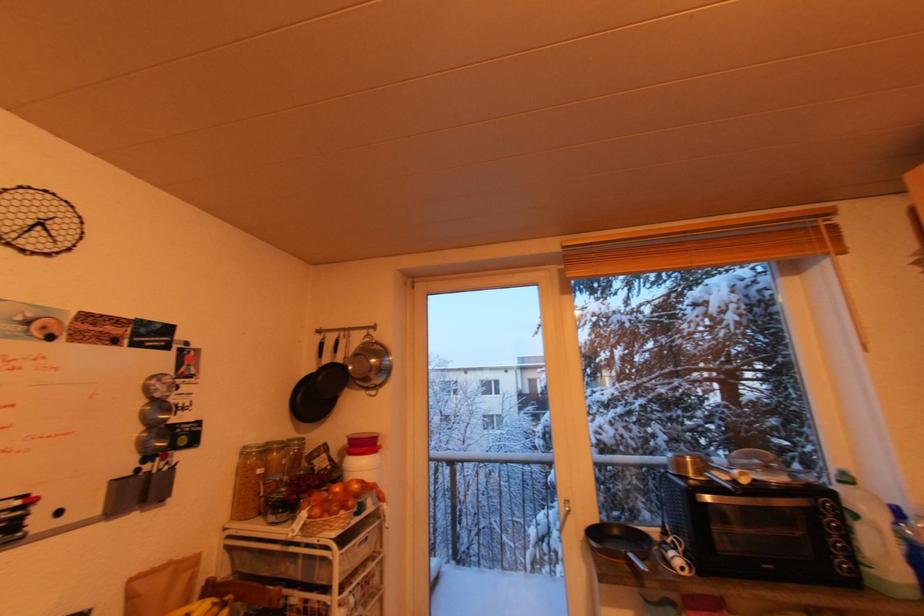
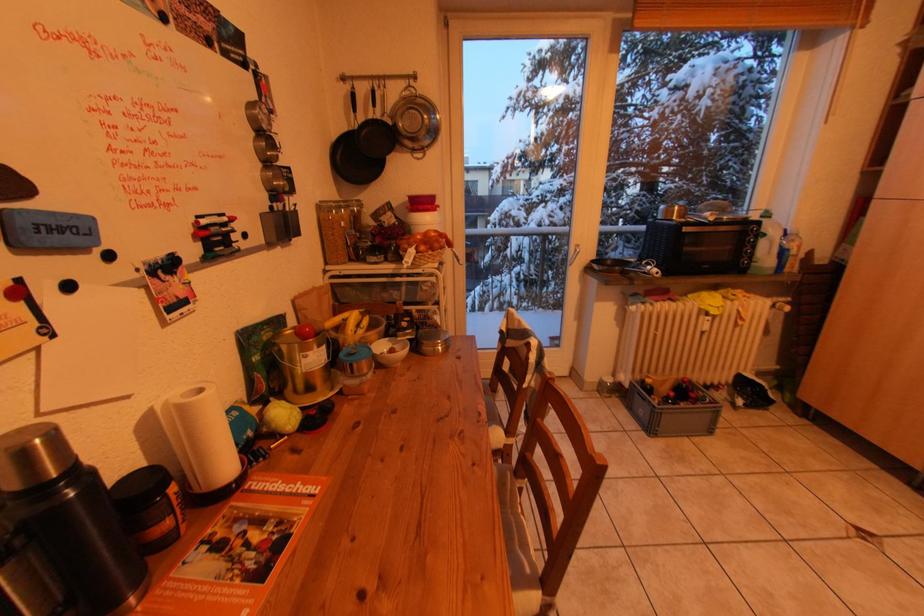
First-person continuous shooting, in which direction is the camera rotating?

The camera rotated toward right-down.